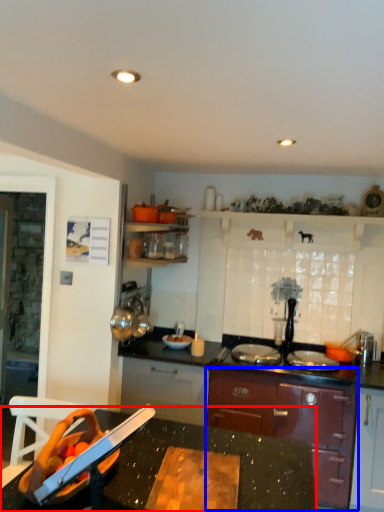
Question: Which point is further to the camera, countertop (highlighted by a red box) or cabinetry (highlighted by a blue box)?

Choices:
 (A) countertop
 (B) cabinetry

Answer: (B)